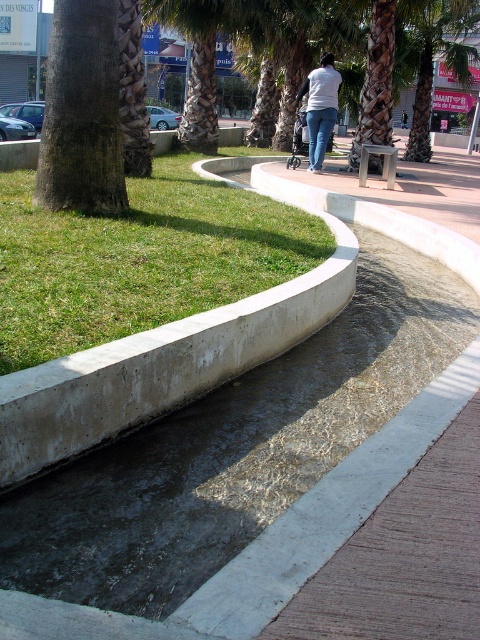
Question: Can you confirm if green grass at lower left is positioned above green leafy palm tree at upper center?

Choices:
 (A) no
 (B) yes

Answer: (A)

Question: Is green grass at lower left above white matte shirt at center?

Choices:
 (A) no
 (B) yes

Answer: (A)

Question: Which object appears closest to the camera in this image?

Choices:
 (A) brown rough tree trunk at left
 (B) white matte shirt at center

Answer: (A)

Question: Which object is farther from the camera taking this photo?

Choices:
 (A) green leafy palm tree at upper center
 (B) brown rough tree trunk at left
 (C) green grass at lower left

Answer: (A)

Question: Is brown rough tree trunk at left to the left of white matte shirt at center from the viewer's perspective?

Choices:
 (A) yes
 (B) no

Answer: (A)

Question: Which of the following is the farthest from the observer?

Choices:
 (A) (330, 61)
 (B) (165, 225)
 (C) (58, 193)

Answer: (A)